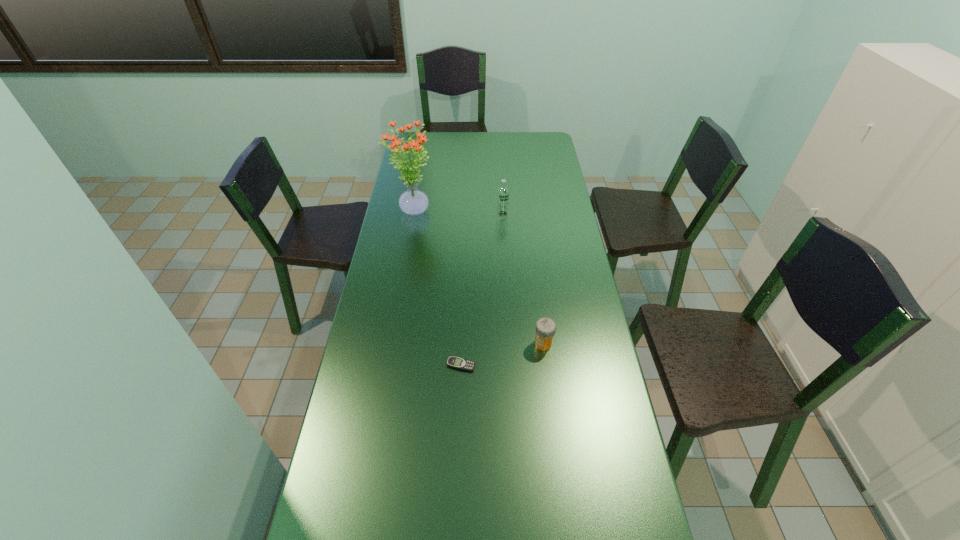
Find the location of `object that stands as the third closest to the second shortest object`. object that stands as the third closest to the second shortest object is located at coordinates (413, 202).

Where is `blank space that satisfies the following two spatial constraints: 1. on the label side of the third tallest object; 2. on the front side of the third object from right to left`? This screenshot has width=960, height=540. blank space that satisfies the following two spatial constraints: 1. on the label side of the third tallest object; 2. on the front side of the third object from right to left is located at coordinates (546, 365).

Image resolution: width=960 pixels, height=540 pixels. What are the coordinates of `vacant space that satisfies the following two spatial constraints: 1. on the label side of the medicine; 2. on the front side of the beeper` in the screenshot? It's located at (546, 365).